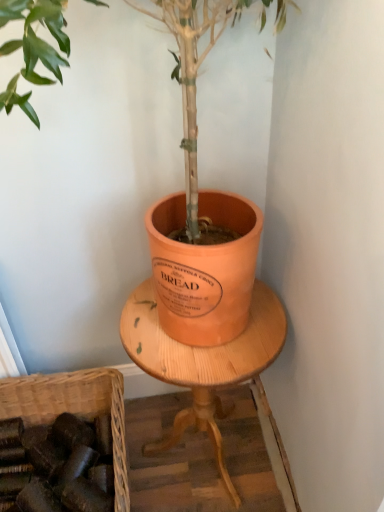
Question: From a real-world perspective, is brown woven basket at lower left on top of matte orange pot at center?

Choices:
 (A) yes
 (B) no

Answer: (B)

Question: Is brown woven basket at lower left facing towards matte orange pot at center?

Choices:
 (A) no
 (B) yes

Answer: (A)

Question: Can you confirm if brown woven basket at lower left is smaller than matte orange pot at center?

Choices:
 (A) no
 (B) yes

Answer: (B)

Question: Can you confirm if brown woven basket at lower left is bigger than matte orange pot at center?

Choices:
 (A) yes
 (B) no

Answer: (B)

Question: Is brown woven basket at lower left wider than matte orange pot at center?

Choices:
 (A) yes
 (B) no

Answer: (B)

Question: Does point (6, 397) appear closer or farther from the camera than point (165, 360)?

Choices:
 (A) closer
 (B) farther

Answer: (B)

Question: Considering the positions of brown woven basket at lower left and wooden round table at center in the image, is brown woven basket at lower left taller or shorter than wooden round table at center?

Choices:
 (A) tall
 (B) short

Answer: (B)

Question: Would you say brown woven basket at lower left is inside or outside wooden round table at center?

Choices:
 (A) outside
 (B) inside

Answer: (A)

Question: Considering their positions, is brown woven basket at lower left located in front of or behind wooden round table at center?

Choices:
 (A) front
 (B) behind

Answer: (B)

Question: Is matte orange pot at center taller or shorter than brown woven basket at lower left?

Choices:
 (A) tall
 (B) short

Answer: (A)

Question: From the image's perspective, relative to brown woven basket at lower left, is matte orange pot at center above or below?

Choices:
 (A) above
 (B) below

Answer: (A)

Question: Based on their sizes in the image, would you say matte orange pot at center is bigger or smaller than brown woven basket at lower left?

Choices:
 (A) big
 (B) small

Answer: (A)

Question: In the image, is matte orange pot at center positioned in front of or behind brown woven basket at lower left?

Choices:
 (A) behind
 (B) front

Answer: (B)

Question: Considering the positions of brown woven basket at lower left and matte orange pot at center in the image, is brown woven basket at lower left bigger or smaller than matte orange pot at center?

Choices:
 (A) big
 (B) small

Answer: (B)

Question: From a real-world perspective, relative to matte orange pot at center, is brown woven basket at lower left vertically above or below?

Choices:
 (A) below
 (B) above

Answer: (A)